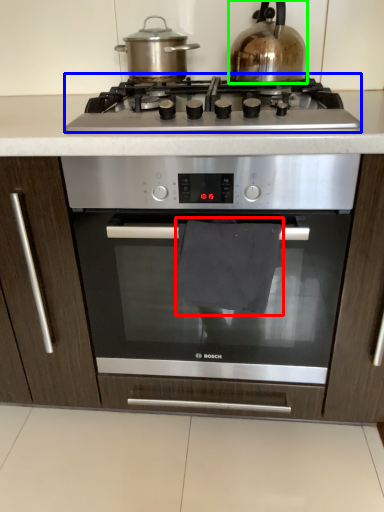
Question: Which is nearer to the material (highlighted by a red box)? gas stove (highlighted by a blue box) or kitchen appliance (highlighted by a green box).

Choices:
 (A) gas stove
 (B) kitchen appliance

Answer: (A)